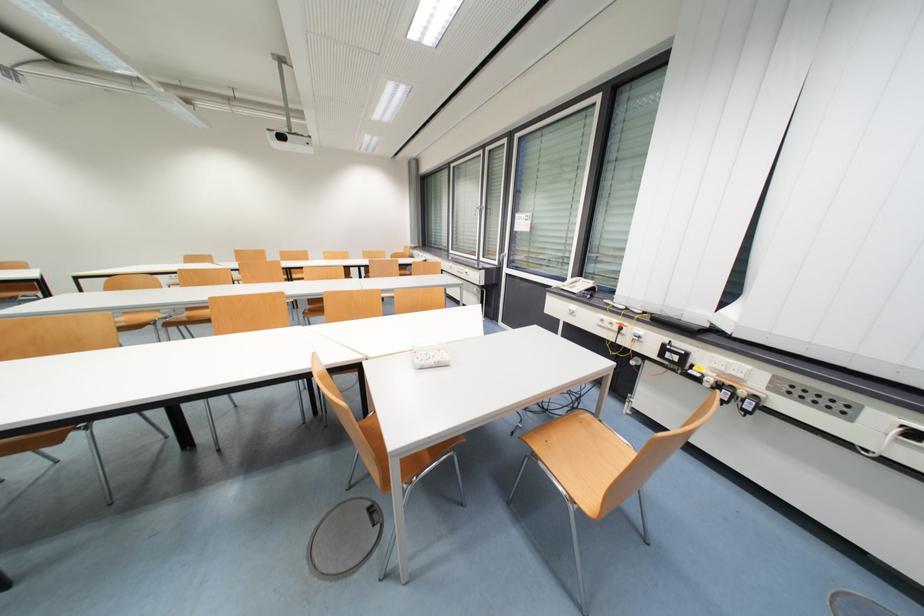
Locate an element on the screen. Image resolution: width=924 pixels, height=616 pixels. wooden chair sitting surface is located at coordinates pyautogui.click(x=580, y=454).